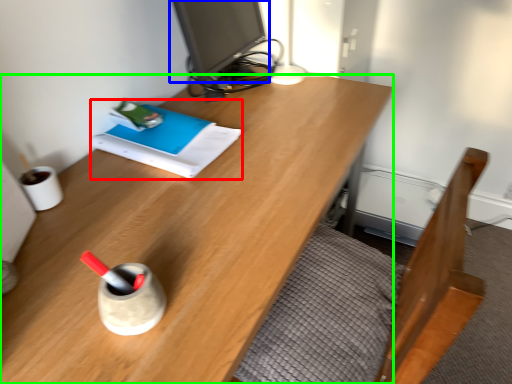
Question: Which object is the closest to the book (highlighted by a red box)? Choose among these: computer monitor (highlighted by a blue box) or desk (highlighted by a green box).

Choices:
 (A) computer monitor
 (B) desk

Answer: (B)